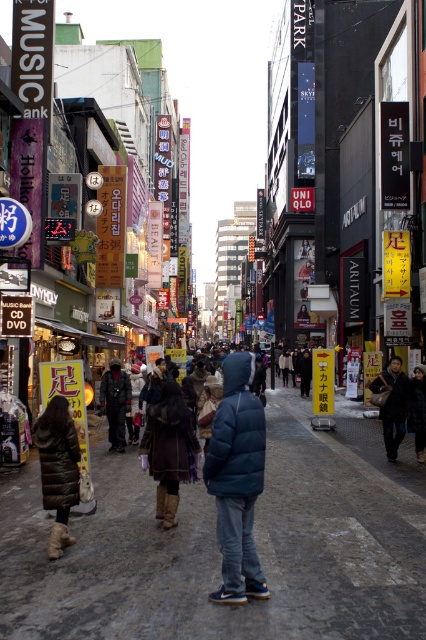
You are a window cleaner needing to reach the top of the matte blue jacket at center and the brown fur coat at lower left. Which object requires you to climb higher?

The brown fur coat at lower left requires climbing higher because it has a greater height than the matte blue jacket at center.

You are a customer in a store looking to purchase a coat that reaches down to your knees. You see the brown fur coat at lower left and the dark brown leather jacket at right. Which one is more likely to meet your requirement based on their heights?

The dark brown leather jacket at right is taller than the brown fur coat at lower left, so it is more likely to reach down to your knees.

You are a window shopper walking down the street and see both the matte blue jacket at center and the brown fur coat at lower left displayed in the store window. Which item takes up more space in the window display?

The matte blue jacket at center is bigger than the brown fur coat at lower left, so it takes up more space in the window display.